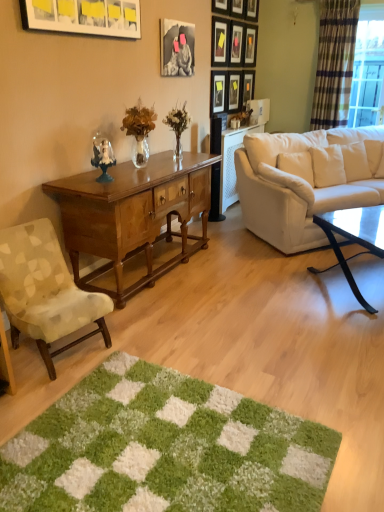
This screenshot has width=384, height=512. I want to click on free space that is in between black metal coffee table at lower right and green shaggy rug at lower center, so click(x=291, y=356).